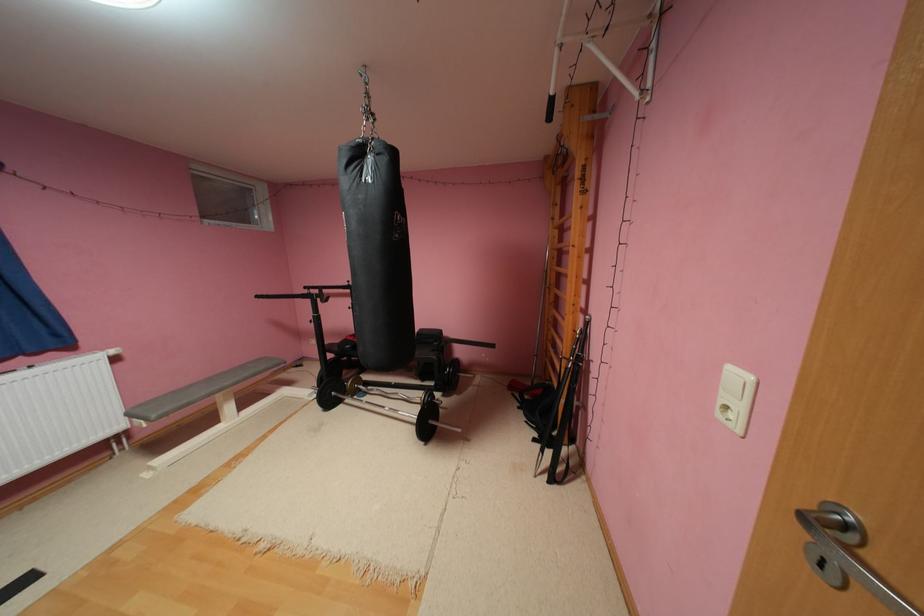
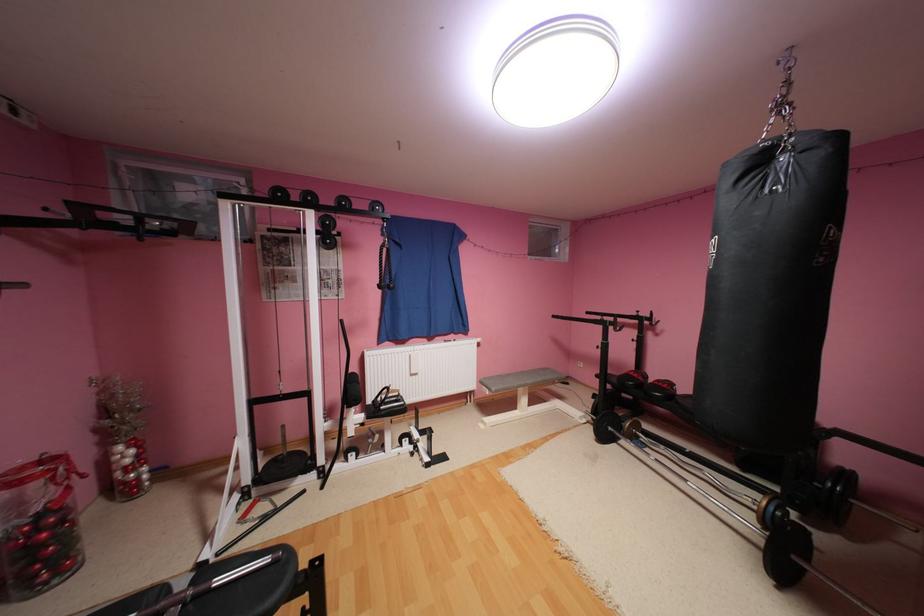
Locate, in the second image, the point that corresponds to (x=345, y=347) in the first image.

(624, 379)